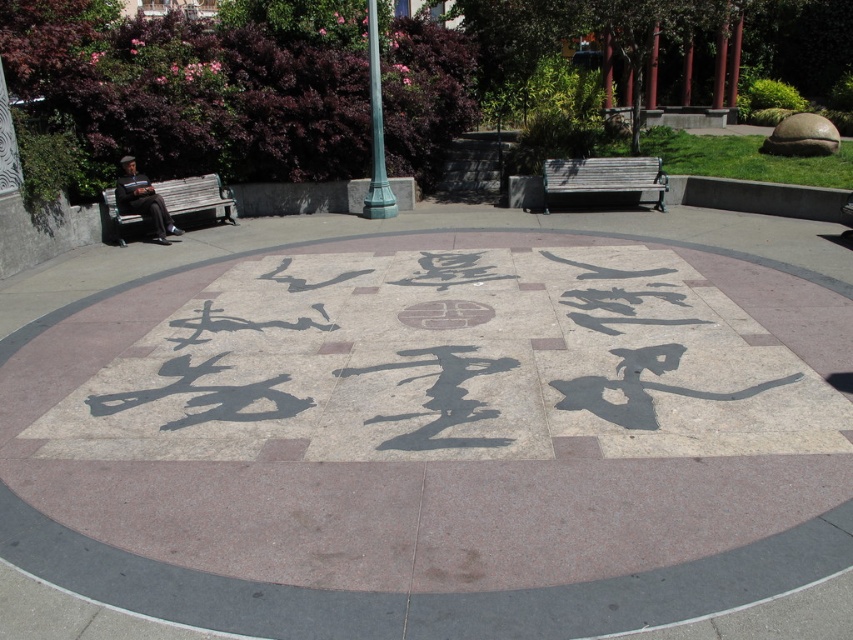
You are planning to host a small gathering and need to seat 4 people. Given the wooden park bench at center and the wooden bench at left, which bench should you choose to accommodate everyone comfortably?

The wooden park bench at center is larger in size than the wooden bench at left, so it can accommodate more people comfortably. Choose the wooden park bench at center.